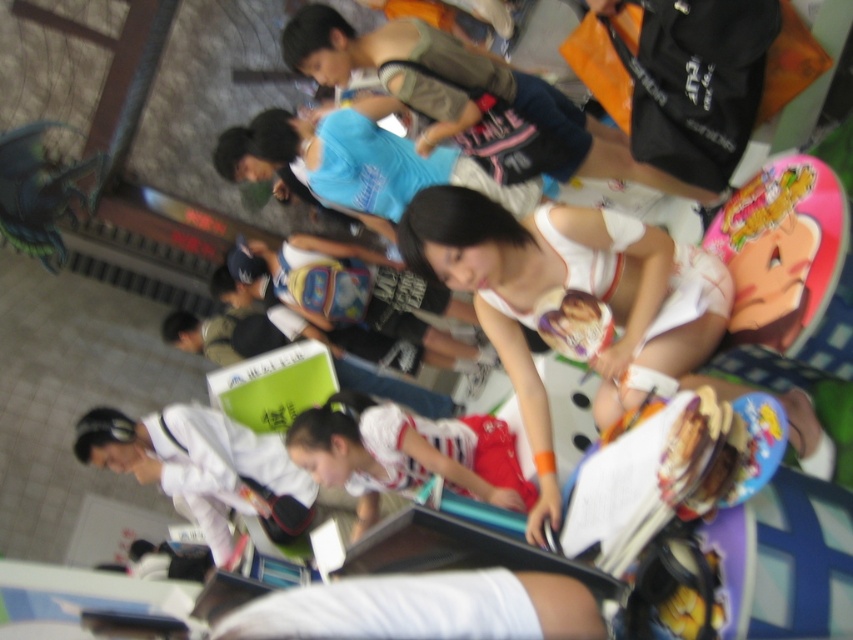
Question: Does white fabric tank top at center appear over white striped shirt at center?

Choices:
 (A) no
 (B) yes

Answer: (B)

Question: Can you confirm if white fabric tank top at center is smaller than white striped shirt at center?

Choices:
 (A) yes
 (B) no

Answer: (B)

Question: Among these points, which one is nearest to the camera?

Choices:
 (A) (416, 433)
 (B) (698, 260)

Answer: (B)

Question: Observing the image, what is the correct spatial positioning of white fabric tank top at center in reference to white striped shirt at center?

Choices:
 (A) right
 (B) left

Answer: (A)

Question: Among these points, which one is farthest from the camera?

Choices:
 (A) (311, 467)
 (B) (495, 305)

Answer: (A)

Question: Among these objects, which one is farthest from the camera?

Choices:
 (A) white striped shirt at center
 (B) white fabric tank top at center

Answer: (A)